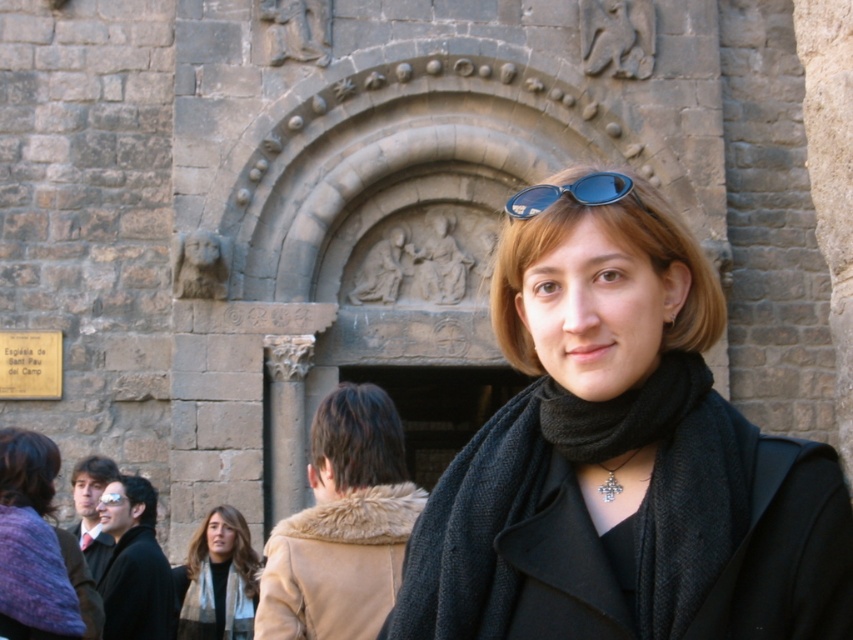
You are a photographer trying to capture the woman in the scene. If you want to focus on the blue reflective lenses at upper center while keeping the beige fur coat at center in the frame, which direction should you adjust your camera?

You should adjust your camera to the right to keep the beige fur coat at center in the frame while focusing on the blue reflective lenses at upper center, since the beige fur coat at center is positioned to the left of the blue reflective lenses at upper center.

You are a photographer trying to capture both the black wool scarf at center and the light brown scarf at lower left in the same frame. Given that your camera has a maximum focus range of 15 meters, will you be able to capture both scarves clearly in one shot?

The distance between the black wool scarf at center and the light brown scarf at lower left is 19.17 meters, which exceeds the camera maximum focus range of 15 meters. Therefore, you cannot capture both scarves clearly in one shot.

You are a photographer who wants to capture a closeup of the black wool scarf at center. Based on the scene description, where should you position your camera to ensure the scarf is in focus?

The black wool scarf at center is located at point (x=619, y=461), so position your camera to focus on that coordinate to capture it clearly.